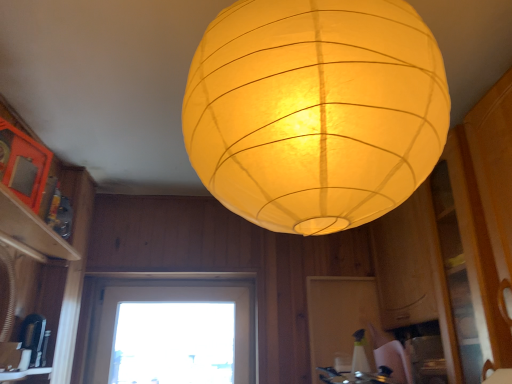
Question: Does metallic silver gas stove at lower center appear on the right side of matte wood shelf at upper left?

Choices:
 (A) no
 (B) yes

Answer: (B)

Question: Is metallic silver gas stove at lower center not within matte wood shelf at upper left?

Choices:
 (A) no
 (B) yes

Answer: (B)

Question: Is metallic silver gas stove at lower center not near matte wood shelf at upper left?

Choices:
 (A) no
 (B) yes

Answer: (B)

Question: From a real-world perspective, is metallic silver gas stove at lower center physically below matte wood shelf at upper left?

Choices:
 (A) yes
 (B) no

Answer: (A)

Question: Is metallic silver gas stove at lower center closer to camera compared to matte wood shelf at upper left?

Choices:
 (A) yes
 (B) no

Answer: (B)

Question: Is matte yellow paper lantern at center to the left or to the right of black plastic coffee maker at lower left in the image?

Choices:
 (A) left
 (B) right

Answer: (B)

Question: Is point (306, 155) positioned closer to the camera than point (41, 349)?

Choices:
 (A) closer
 (B) farther

Answer: (A)

Question: In terms of width, does matte yellow paper lantern at center look wider or thinner when compared to black plastic coffee maker at lower left?

Choices:
 (A) wide
 (B) thin

Answer: (A)

Question: In the image, is matte yellow paper lantern at center positioned in front of or behind black plastic coffee maker at lower left?

Choices:
 (A) front
 (B) behind

Answer: (A)

Question: From the image's perspective, is metallic silver gas stove at lower center positioned above or below transparent glass window at center?

Choices:
 (A) below
 (B) above

Answer: (B)

Question: Considering the relative positions of metallic silver gas stove at lower center and transparent glass window at center in the image provided, is metallic silver gas stove at lower center to the left or to the right of transparent glass window at center?

Choices:
 (A) right
 (B) left

Answer: (A)

Question: Looking at the image, does metallic silver gas stove at lower center seem bigger or smaller compared to transparent glass window at center?

Choices:
 (A) big
 (B) small

Answer: (B)

Question: Considering the positions of point (381, 367) and point (124, 370), is point (381, 367) closer or farther from the camera than point (124, 370)?

Choices:
 (A) farther
 (B) closer

Answer: (B)

Question: From a real-world perspective, relative to matte wood shelf at upper left, is matte yellow paper lantern at center vertically above or below?

Choices:
 (A) above
 (B) below

Answer: (A)

Question: Considering the positions of matte yellow paper lantern at center and matte wood shelf at upper left in the image, is matte yellow paper lantern at center taller or shorter than matte wood shelf at upper left?

Choices:
 (A) tall
 (B) short

Answer: (A)